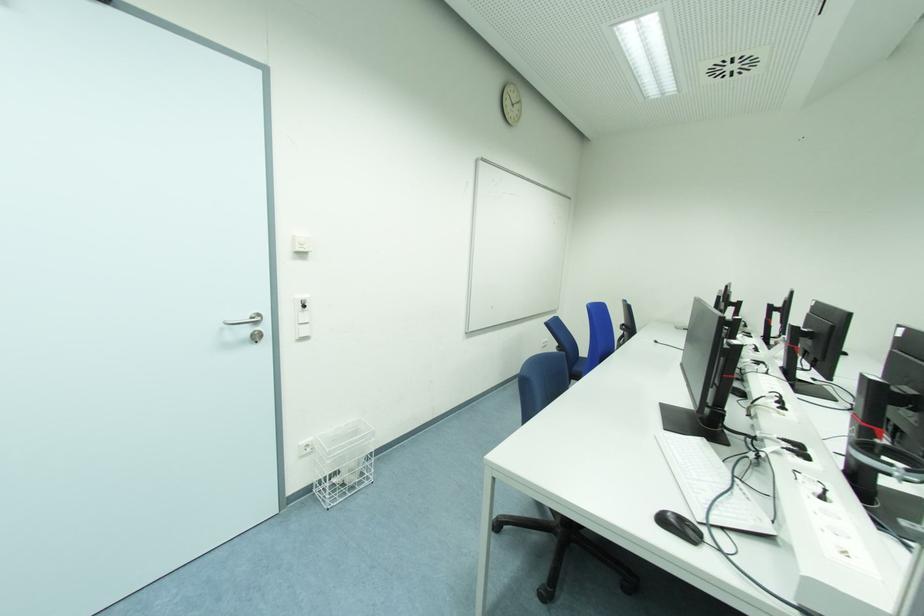
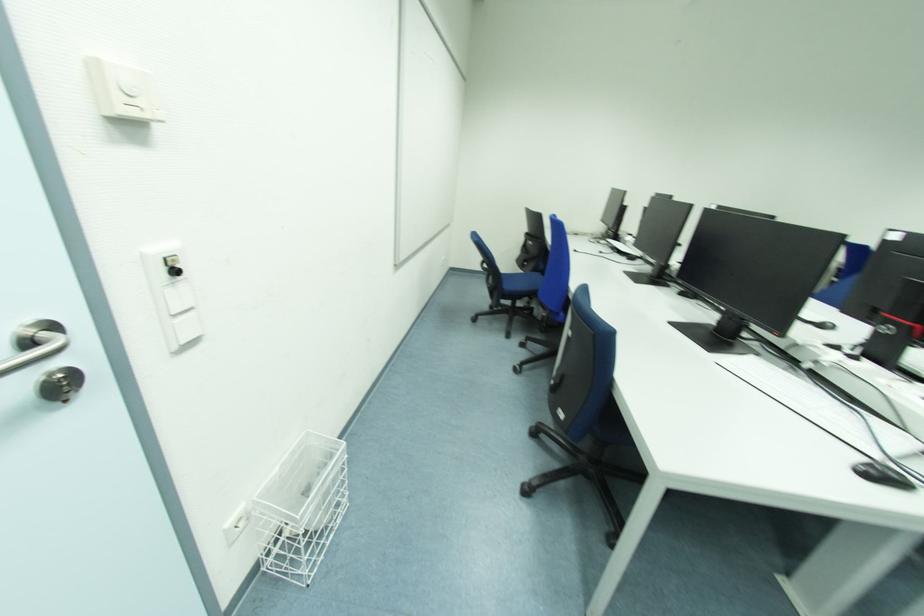
How did the camera likely rotate?

The rotation direction of the camera is right-down.